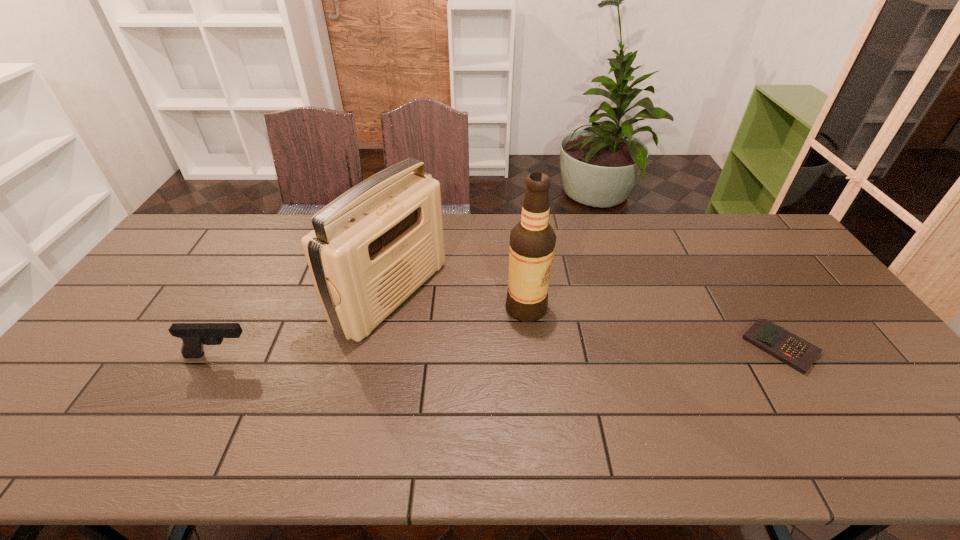
Image resolution: width=960 pixels, height=540 pixels. I want to click on free space located on the front-facing side of the radio receiver, so (x=471, y=340).

Where is `vacant space positioned on the label of the alcohol`? vacant space positioned on the label of the alcohol is located at coordinates (567, 341).

You are a GUI agent. You are given a task and a screenshot of the screen. Output one action in this format:
    pyautogui.click(x=<x>, y=<y>)
    Task: Click on the vacant space located on the label of the alcohol
    Image resolution: width=960 pixels, height=540 pixels.
    Given the screenshot: What is the action you would take?
    pyautogui.click(x=554, y=330)

The image size is (960, 540). Find the location of `vacant area situated on the label of the alcohol`. vacant area situated on the label of the alcohol is located at coordinates (646, 404).

The width and height of the screenshot is (960, 540). I want to click on object present at the far edge, so click(372, 247).

I want to click on object that is at the right edge, so click(x=799, y=354).

This screenshot has height=540, width=960. What are the coordinates of `vacant space at the far edge of the desktop` in the screenshot? It's located at (479, 224).

Where is `free point at the near edge`? This screenshot has width=960, height=540. free point at the near edge is located at coordinates (418, 391).

Where is `vacant area at the left edge of the desktop`? This screenshot has width=960, height=540. vacant area at the left edge of the desktop is located at coordinates (88, 380).

The image size is (960, 540). In the image, there is a desktop. Identify the location of vacant space at the right edge. (818, 291).